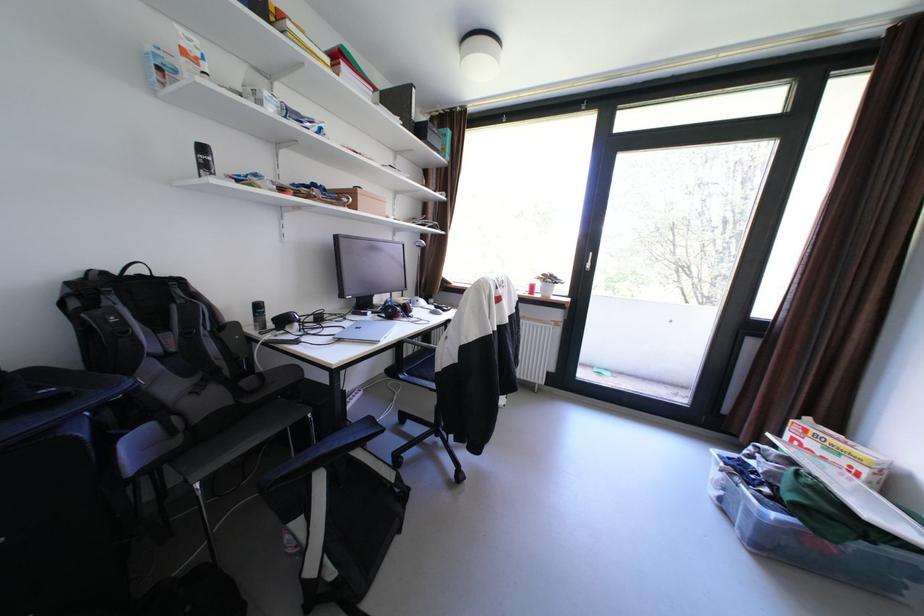
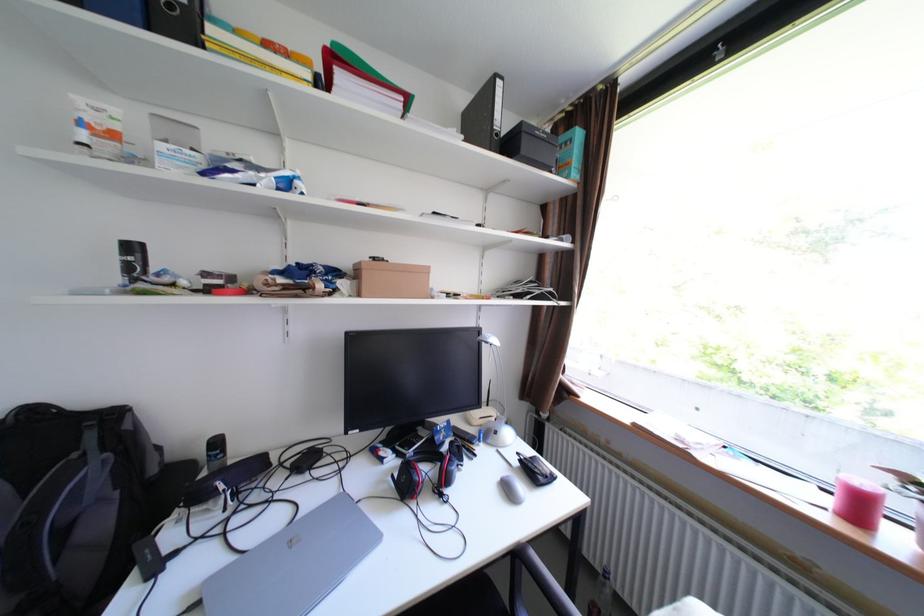
Question: I am providing you with two images of the same scene from different viewpoints. Which of the following objects are not visible in image2?

Choices:
 (A) red and black headphones
 (B) black binder
 (C) backpack handle
 (D) none of these

Answer: (D)